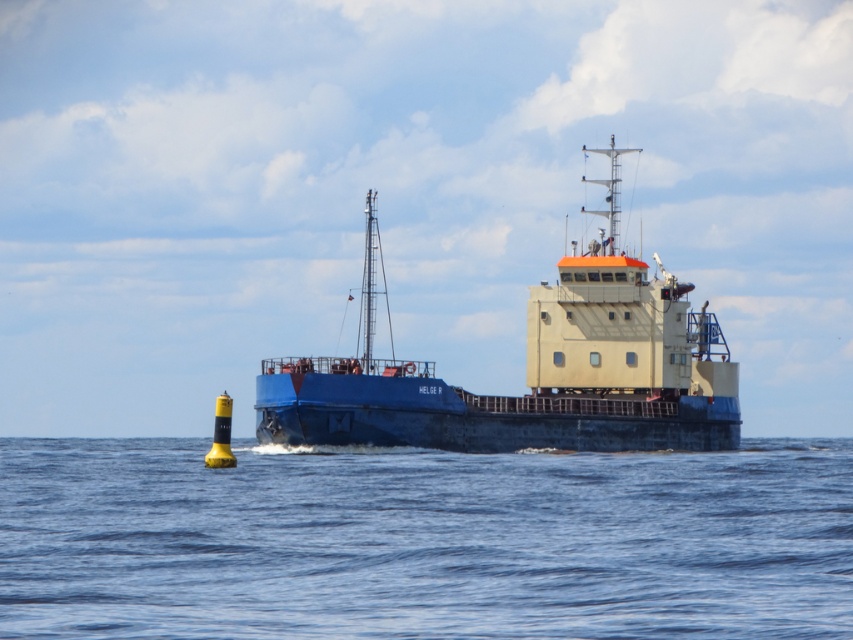
Can you confirm if blue water at lower center is taller than blue matte ship at center?

No.

Who is lower down, blue water at lower center or blue matte ship at center?

blue water at lower center is lower down.

Is point (804, 506) farther from camera compared to point (585, 433)?

No, it is in front of (585, 433).

Locate an element on the screen. This screenshot has width=853, height=640. blue water at lower center is located at coordinates (422, 541).